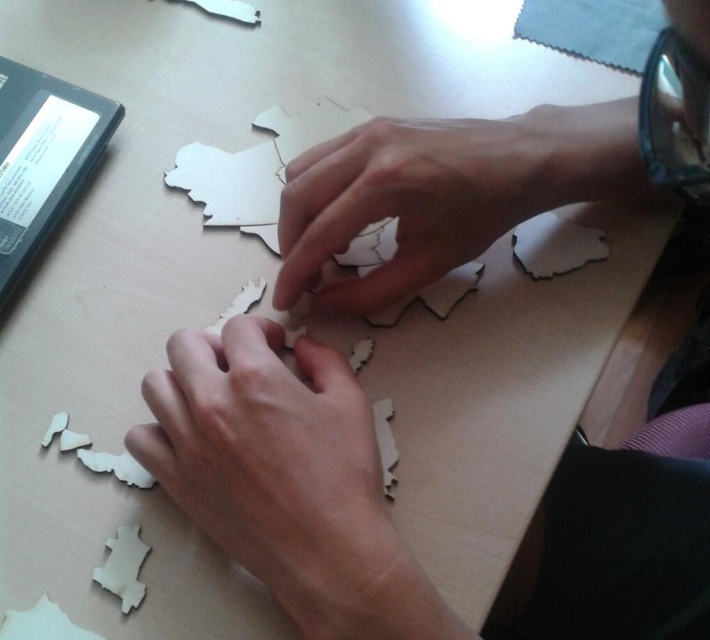
Question: Which object is farther from the camera taking this photo?

Choices:
 (A) matte wood hand at center
 (B) wooden puzzle piece at center

Answer: (B)

Question: Which point is farther to the camera?

Choices:
 (A) matte wood hand at center
 (B) wooden puzzle piece at center

Answer: (B)

Question: Can you confirm if matte wood hand at center is smaller than wooden puzzle piece at center?

Choices:
 (A) no
 (B) yes

Answer: (B)

Question: Considering the relative positions of matte wood hand at center and wooden puzzle piece at center in the image provided, where is matte wood hand at center located with respect to wooden puzzle piece at center?

Choices:
 (A) right
 (B) left

Answer: (B)

Question: Does matte wood hand at center have a greater width compared to wooden puzzle piece at center?

Choices:
 (A) no
 (B) yes

Answer: (A)

Question: Which point is closer to the camera?

Choices:
 (A) matte wood hand at center
 (B) wooden puzzle piece at center

Answer: (A)